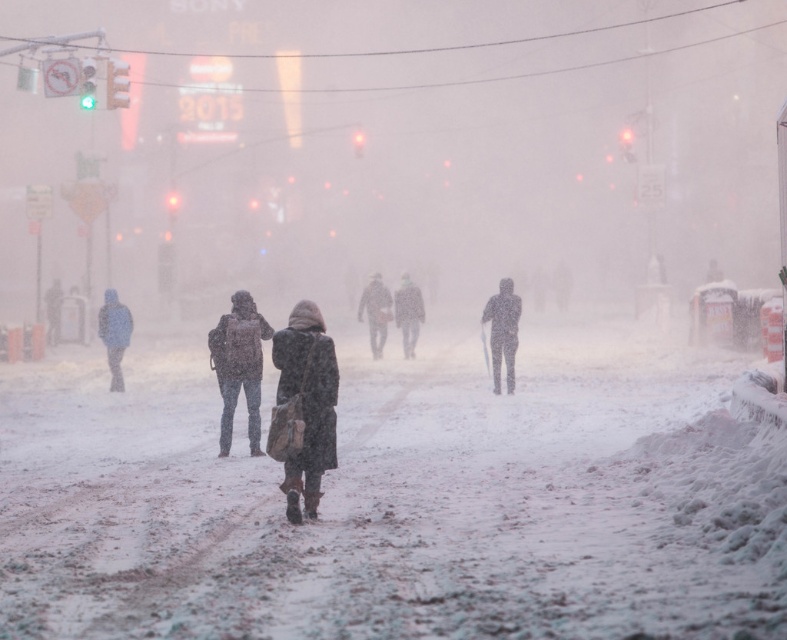
You are a drone operator trying to capture aerial footage of two points in a snowy scene. The first point is at coordinates point (301,461) and the second is at point (412,330). Which point is nearer to the camera to ensure better focus?

Point (301,461) is closer to the camera than point (412,330), so it will be in better focus.

You are a delivery person trying to navigate through the snowy street. You see two people ahead wearing coats. The first is wearing a dark brown leather coat at center and the second is wearing a dark gray coat at left. Which coat is positioned lower in the image?

The dark brown leather coat at center is located below the dark gray coat at left, so the dark brown leather coat at center is positioned lower in the image.